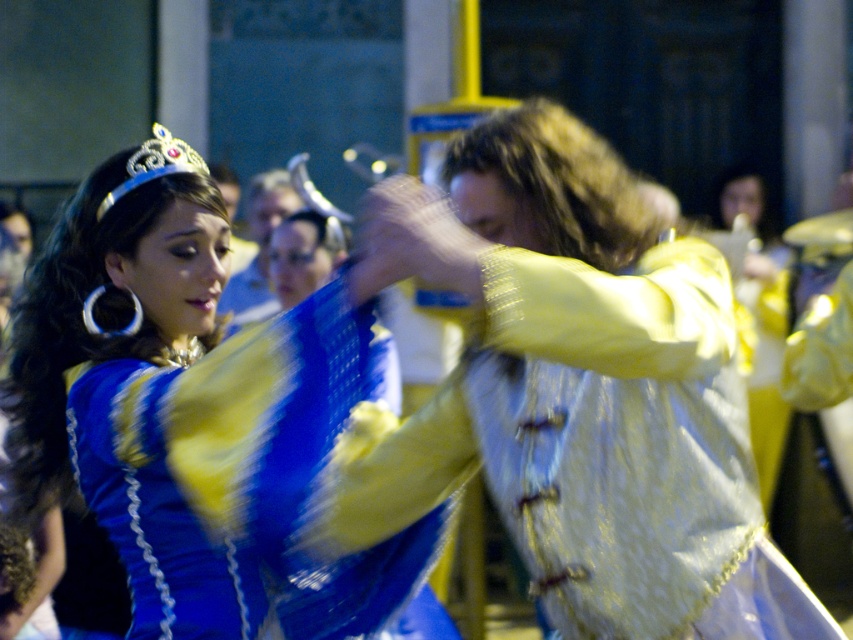
You are a photographer adjusting your camera settings to capture the dancers. You notice the blue satin dress at left and the silver metallic crown at upper left. Which object is positioned higher in the image?

The silver metallic crown at upper left is positioned higher than the blue satin dress at left.

You are a photographer adjusting the focus of your camera. You have two points to focus on in the scene described. The first is point (531, 182) and the second is point (421, 524). Which point should you choose to ensure the subject closest to the viewer is in focus?

Point (531, 182) should be chosen because it is closer to the viewer than point (421, 524), ensuring the nearest subject is in focus.

You are a photographer setting up a shoot and need to ensure that the shiny blue fabric at center and the silver metallic crown at upper left are both visible in the frame. Given their sizes, which object requires more horizontal space in the composition?

The shiny blue fabric at center requires more horizontal space in the composition because its width surpasses that of the silver metallic crown at upper left.